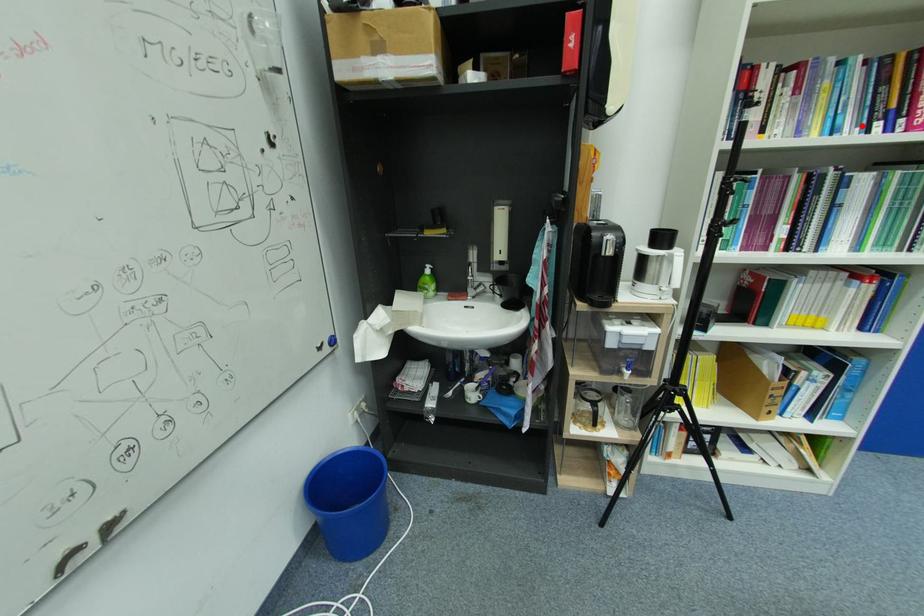
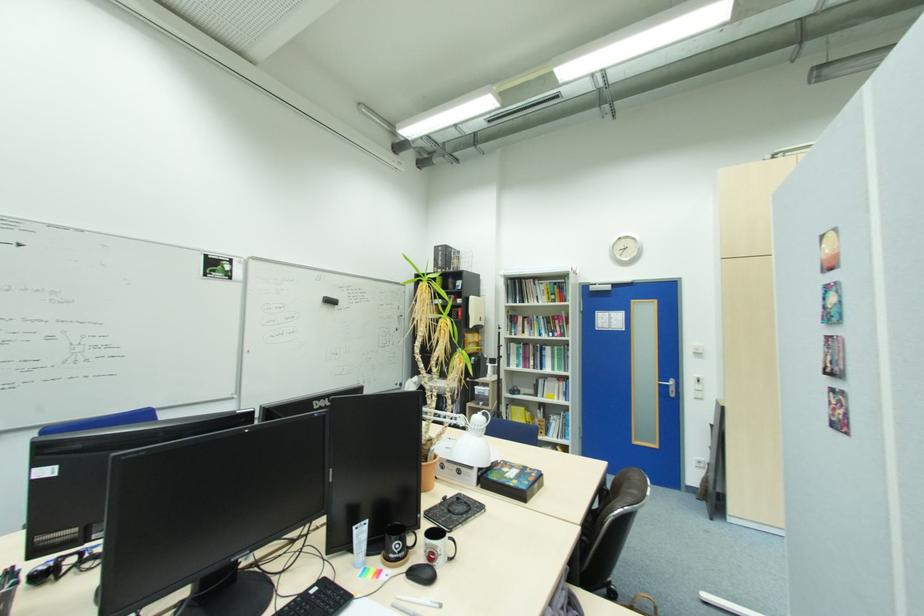
Where in the second image is the point corresponding to the highlighted location from the first image?

(550, 334)